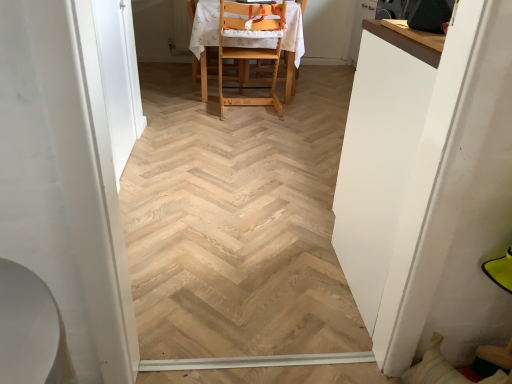
Identify the location of free space to the back side of white glossy door at left, which is the 1th screen door from back to front. The image size is (512, 384). (172, 132).